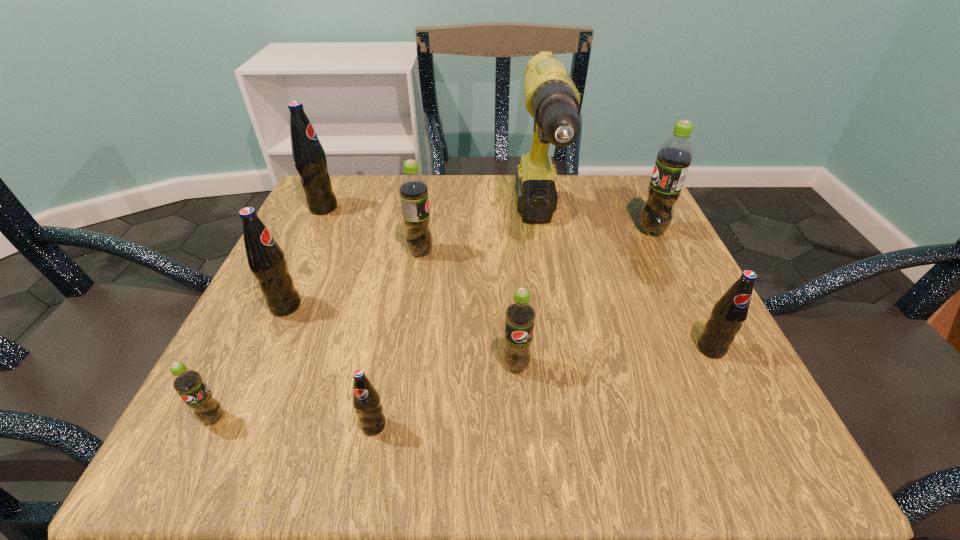
Find the location of a particular element. vacant space that satisfies the following two spatial constraints: 1. on the front label of the seventh nearest soda; 2. on the front label of the nearest black pop is located at coordinates (747, 426).

Image resolution: width=960 pixels, height=540 pixels. In order to click on vacant space that satisfies the following two spatial constraints: 1. on the front label of the fifth nearest soda; 2. on the front label of the nearest green soda in this screenshot , I will do `click(234, 418)`.